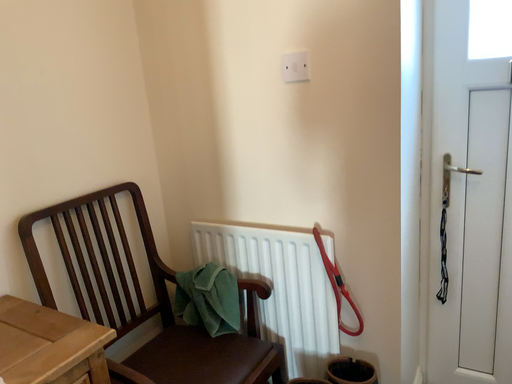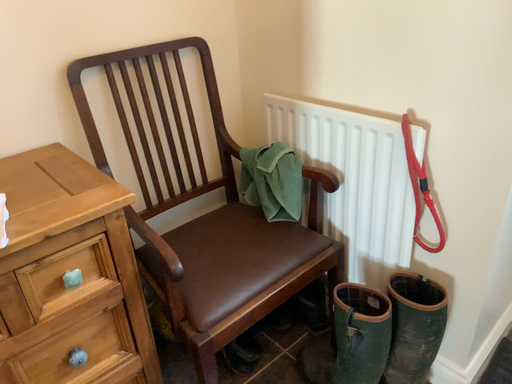
Question: Which way did the camera rotate in the video?

Choices:
 (A) rotated left
 (B) rotated right

Answer: (A)